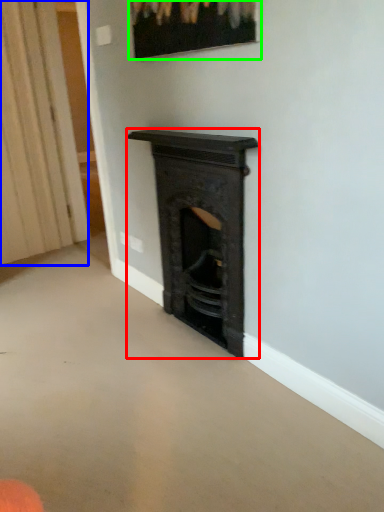
Question: Considering the real-world distances, which object is farthest from fireplace (highlighted by a red box)? curtain (highlighted by a blue box) or picture frame (highlighted by a green box)?

Choices:
 (A) curtain
 (B) picture frame

Answer: (A)